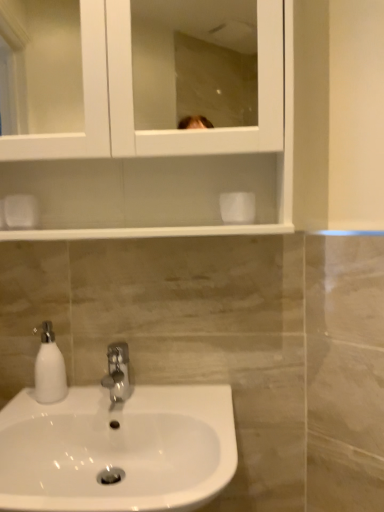
Question: Is white glossy sink at lower left taller than white glossy medicine cabinet at upper center?

Choices:
 (A) no
 (B) yes

Answer: (A)

Question: Does white glossy sink at lower left come behind white glossy medicine cabinet at upper center?

Choices:
 (A) no
 (B) yes

Answer: (A)

Question: Does white glossy sink at lower left have a lesser width compared to white glossy medicine cabinet at upper center?

Choices:
 (A) no
 (B) yes

Answer: (A)

Question: Is white glossy sink at lower left to the left of white glossy medicine cabinet at upper center from the viewer's perspective?

Choices:
 (A) no
 (B) yes

Answer: (B)

Question: Is white glossy sink at lower left facing towards white glossy medicine cabinet at upper center?

Choices:
 (A) yes
 (B) no

Answer: (B)

Question: Can you confirm if white glossy sink at lower left is smaller than white glossy medicine cabinet at upper center?

Choices:
 (A) no
 (B) yes

Answer: (A)

Question: Is white glossy sink at lower left oriented towards polished chrome faucet at center?

Choices:
 (A) yes
 (B) no

Answer: (B)

Question: From a real-world perspective, is white glossy sink at lower left on top of polished chrome faucet at center?

Choices:
 (A) no
 (B) yes

Answer: (A)

Question: Considering the relative positions of white glossy sink at lower left and polished chrome faucet at center in the image provided, is white glossy sink at lower left to the left of polished chrome faucet at center from the viewer's perspective?

Choices:
 (A) yes
 (B) no

Answer: (A)

Question: Can we say white glossy sink at lower left lies outside polished chrome faucet at center?

Choices:
 (A) no
 (B) yes

Answer: (B)

Question: Is the depth of white glossy sink at lower left less than that of polished chrome faucet at center?

Choices:
 (A) yes
 (B) no

Answer: (A)

Question: Can you confirm if white glossy sink at lower left is positioned to the right of polished chrome faucet at center?

Choices:
 (A) yes
 (B) no

Answer: (B)

Question: Is white glossy soap dispenser at lower left behind white glossy medicine cabinet at upper center?

Choices:
 (A) yes
 (B) no

Answer: (A)